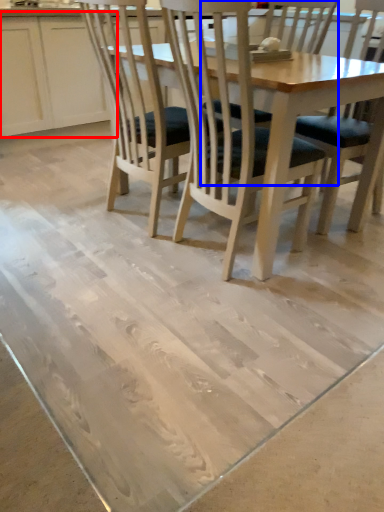
Question: Which object is closer to the camera taking this photo, cabinetry (highlighted by a red box) or chair (highlighted by a blue box)?

Choices:
 (A) cabinetry
 (B) chair

Answer: (B)